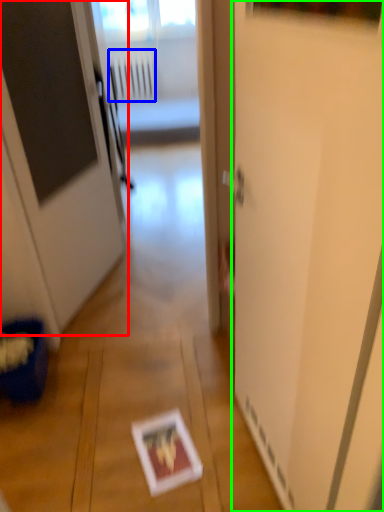
Question: Estimate the real-world distances between objects in this image. Which object is closer to door (highlighted by a red box), radiator (highlighted by a blue box) or screen door (highlighted by a green box)?

Choices:
 (A) radiator
 (B) screen door

Answer: (B)